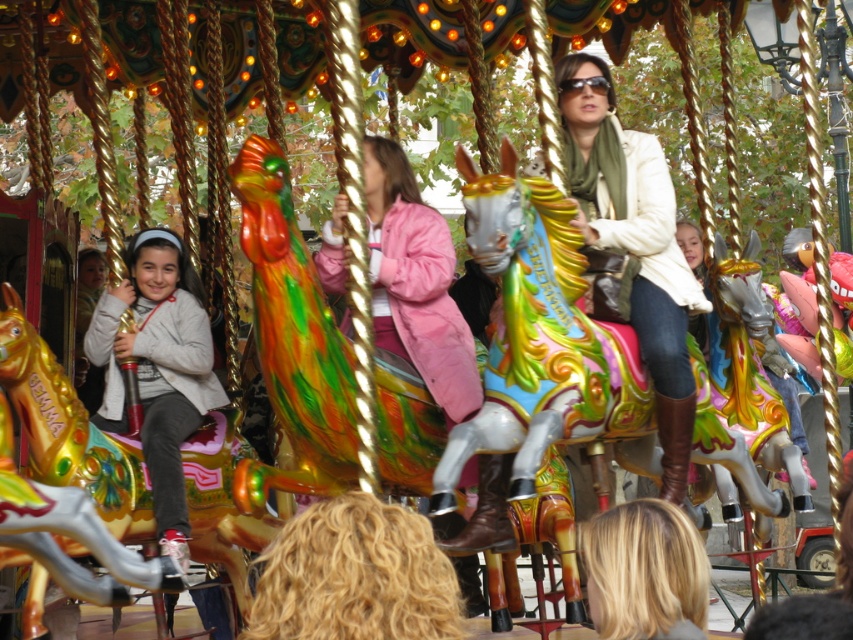
Does matte white jacket at center have a greater width compared to matte gray jacket at left?

Yes.

In order to click on matte white jacket at center in this screenshot , I will do `click(634, 244)`.

From the picture: Does matte white jacket at center have a greater height compared to shiny gold horse at left?

Yes, matte white jacket at center is taller than shiny gold horse at left.

Based on the photo, who is more distant from viewer, (653, 212) or (120, 524)?

Point (653, 212)

Does point (618, 120) lie in front of point (190, 499)?

No, it is behind (190, 499).

At what (x,y) coordinates should I click in order to perform the action: click on matte white jacket at center. Please return your answer as a coordinate pair (x, y). The height and width of the screenshot is (640, 853). Looking at the image, I should click on (634, 244).

Is shiny metallic horse at center behind shiny gold horse at left?

Yes, shiny metallic horse at center is further from the viewer.

Between point (498, 442) and point (22, 349), which one is positioned in front?

Point (498, 442)

Between point (479, 228) and point (126, 529), which one is positioned in front?

Point (479, 228)

In order to click on shiny metallic horse at center in this screenshot , I will do `click(543, 340)`.